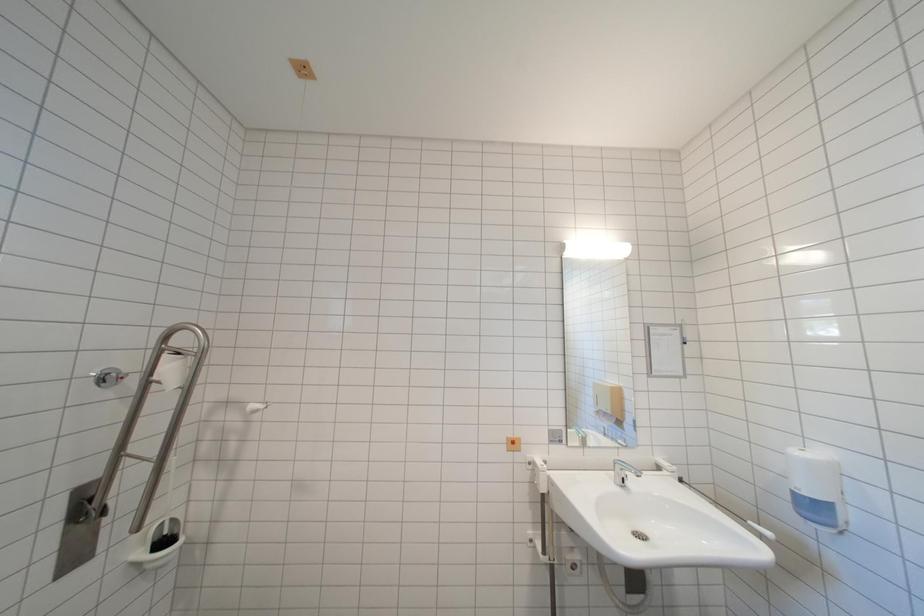
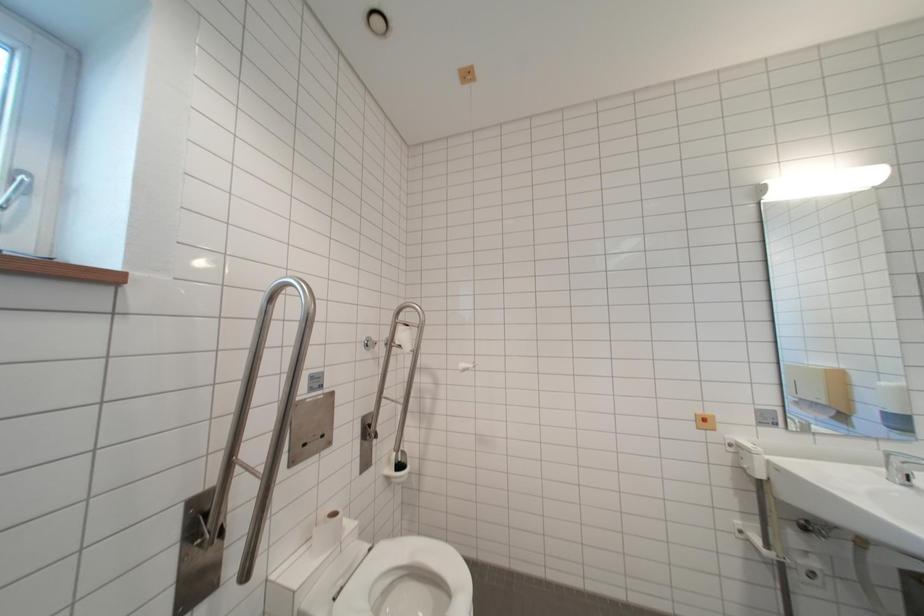
What movement of the cameraman would produce the second image?

The cameraman moved toward left, backward.